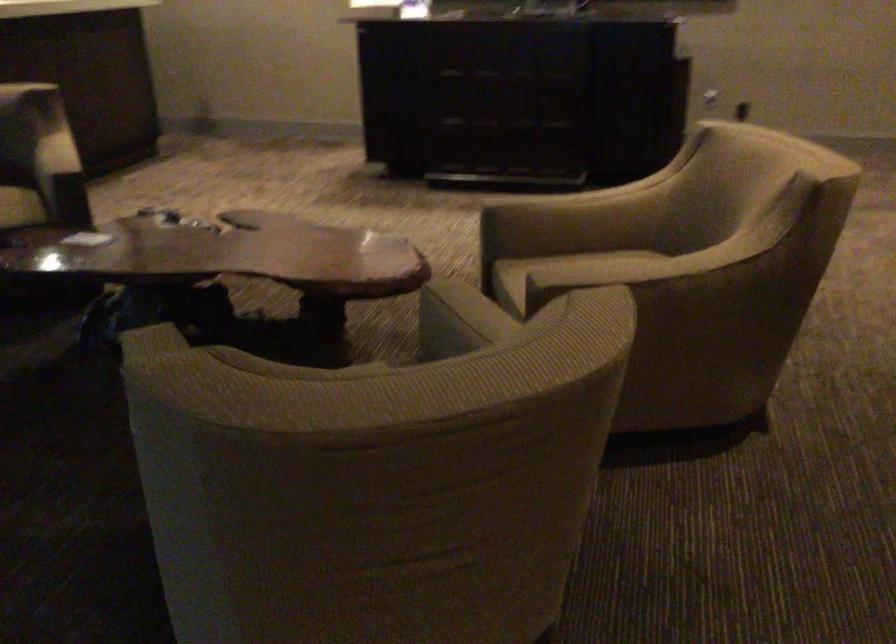
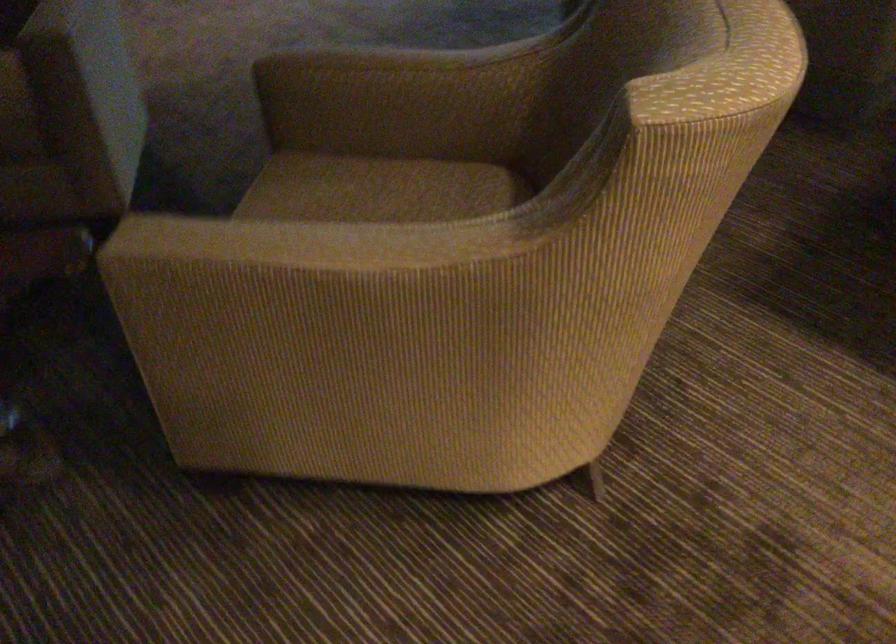
Find the pixel in the second image that matches (x=73, y=146) in the first image.

(298, 243)